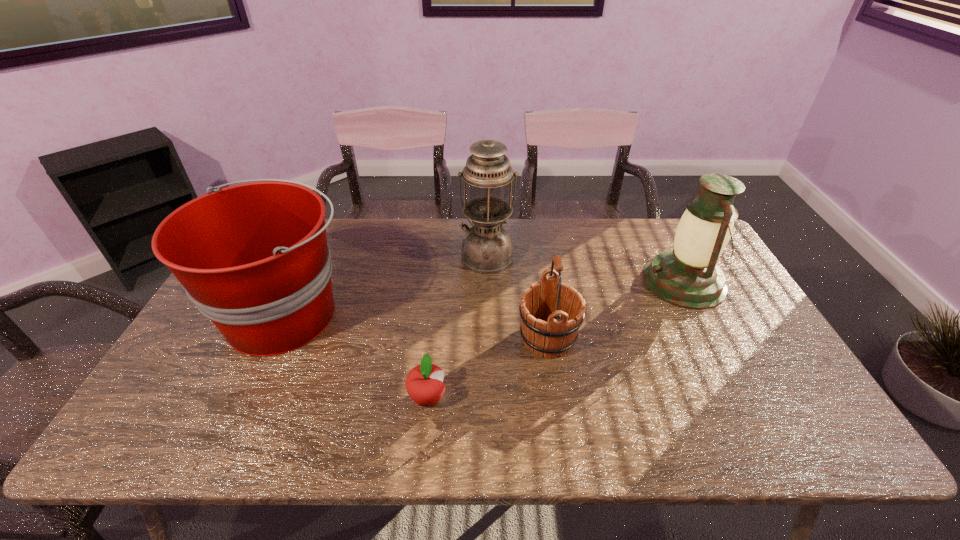
I want to click on free location located 0.110m on the front of the leftmost object, so click(x=241, y=409).

I want to click on vacant space located on the back of the wine bucket, so click(x=541, y=295).

Find the location of a particular element. This screenshot has height=540, width=960. vacant region located on the back of the shortest object is located at coordinates (438, 301).

This screenshot has width=960, height=540. What are the coordinates of `oil lamp situated at the far edge` in the screenshot? It's located at (487, 248).

Find the location of a particular element. Image resolution: width=960 pixels, height=540 pixels. lantern present at the far edge is located at coordinates pyautogui.click(x=687, y=276).

Locate an element on the screen. The width and height of the screenshot is (960, 540). object that is positioned at the near edge is located at coordinates (424, 383).

The height and width of the screenshot is (540, 960). I want to click on object present at the left edge, so click(254, 258).

Identify the location of object located in the right edge section of the desktop. (687, 276).

Locate an element on the screen. Image resolution: width=960 pixels, height=540 pixels. object that is at the far right corner is located at coordinates (687, 276).

This screenshot has height=540, width=960. I want to click on vacant space at the far edge, so click(x=350, y=237).